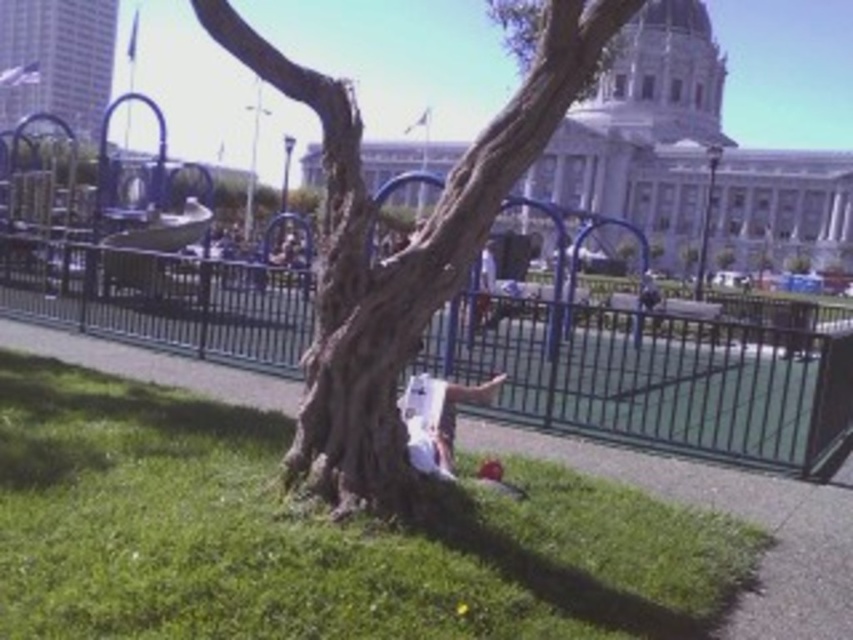
Who is more distant from viewer, (300, 353) or (556, 0)?

The point (300, 353) is behind.

Measure the distance from black metal fence at center to smooth bark tree at center.

black metal fence at center is 46.53 feet from smooth bark tree at center.

Measure the distance between point (30, 289) and camera.

Point (30, 289) is 53.61 meters from camera.

I want to click on black metal fence at center, so click(672, 384).

Between green grass at center and smooth bark tree at center, which one has more height?

Standing taller between the two is smooth bark tree at center.

Who is more forward, (404, 529) or (334, 321)?

Point (404, 529) is more forward.

Where is `green grass at center`? The width and height of the screenshot is (853, 640). green grass at center is located at coordinates (312, 536).

Does green grass at center have a larger size compared to black metal fence at center?

Actually, green grass at center might be smaller than black metal fence at center.

From the picture: Is green grass at center above black metal fence at center?

No.

Measure the distance between green grass at center and camera.

green grass at center is 72.38 feet from camera.

Where is `green grass at center`? This screenshot has height=640, width=853. green grass at center is located at coordinates (312, 536).